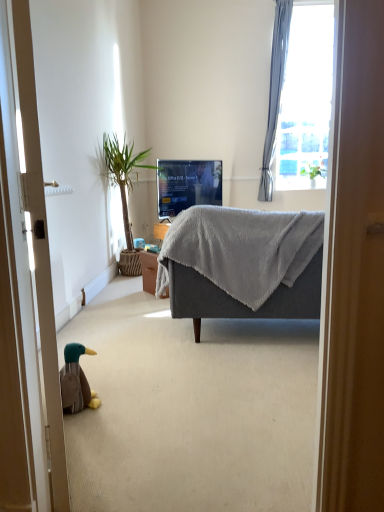
Image resolution: width=384 pixels, height=512 pixels. In order to click on free space in front of brown plush duck at lower left in this screenshot , I will do `click(86, 421)`.